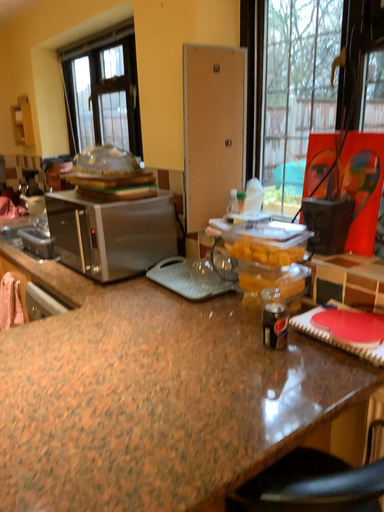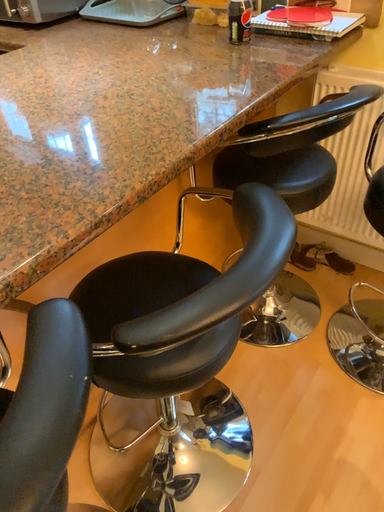
Question: How did the camera likely rotate when shooting the video?

Choices:
 (A) rotated left
 (B) rotated right

Answer: (B)